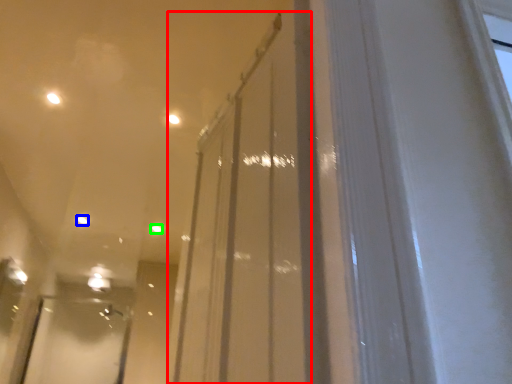
Question: Based on their relative distances, which object is farther from glass door (highlighted by a red box)? Choose from light (highlighted by a blue box) and light (highlighted by a green box).

Choices:
 (A) light
 (B) light

Answer: (A)